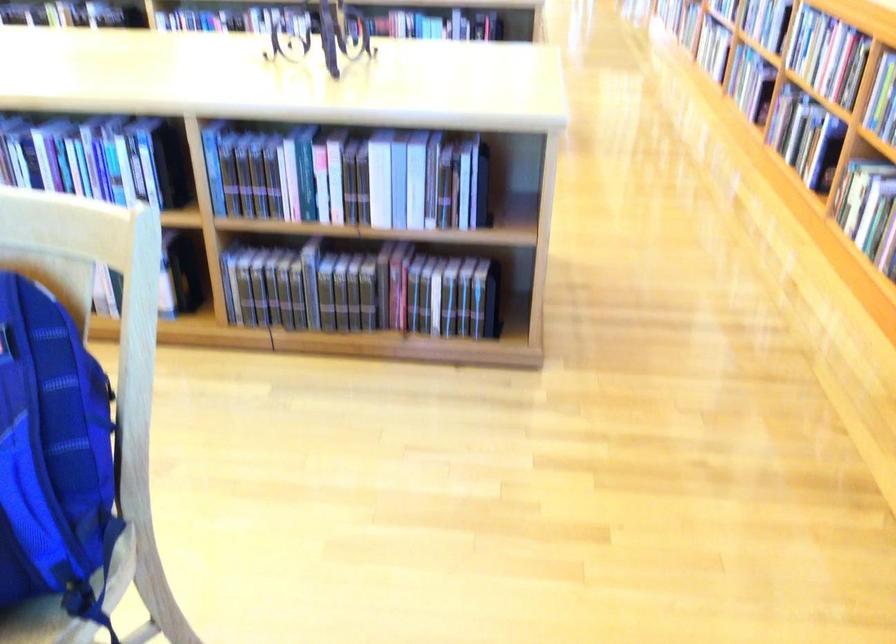
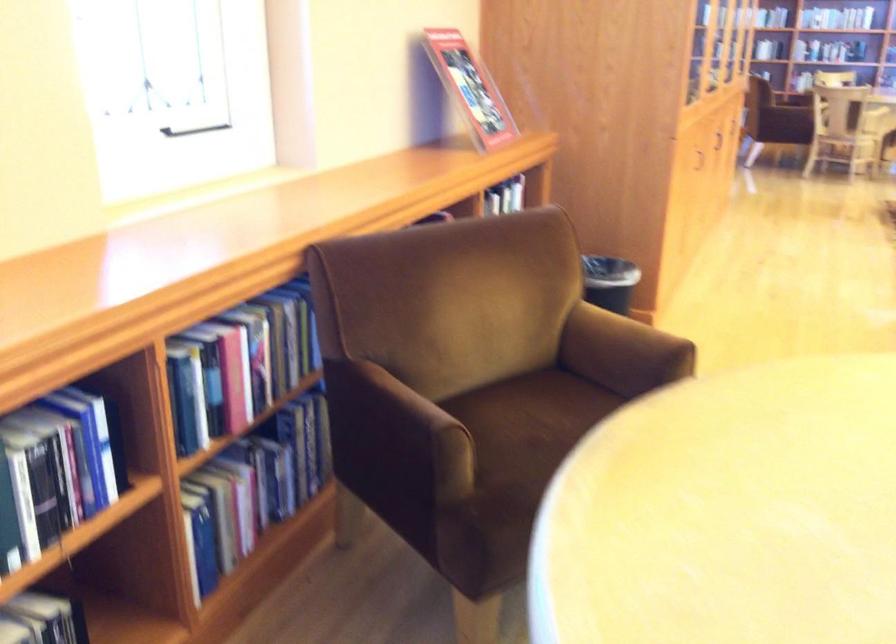
First-person continuous shooting, in which direction is the camera rotating?

The rotation direction of the camera is left-down.